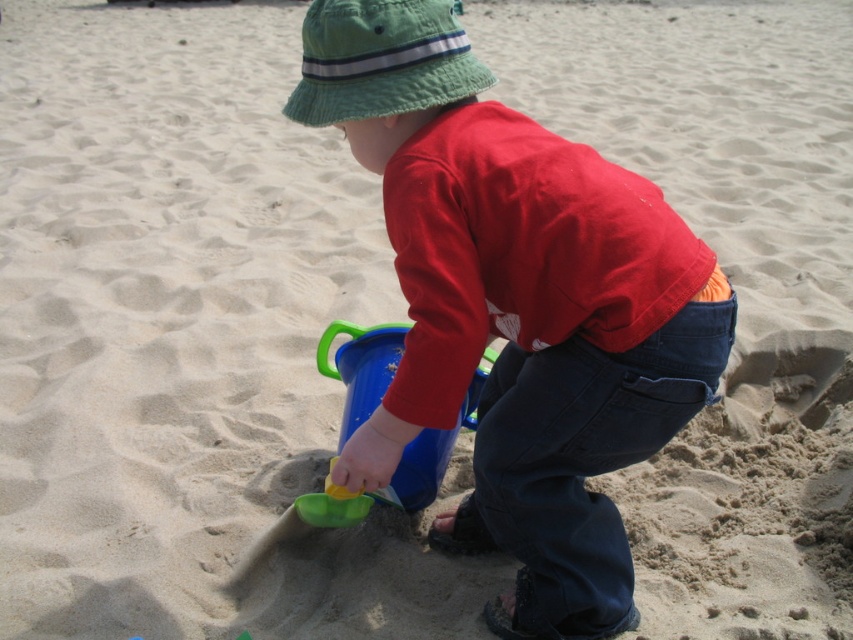
Question: Which point appears closest to the camera in this image?

Choices:
 (A) (380, 362)
 (B) (550, 513)

Answer: (B)

Question: Which point is closer to the camera?

Choices:
 (A) (431, 67)
 (B) (444, 49)
 (C) (350, 512)

Answer: (A)

Question: Is matte blue bucket at center positioned at the back of green fabric hat at upper center?

Choices:
 (A) yes
 (B) no

Answer: (B)

Question: Which point is closer to the camera?

Choices:
 (A) matte blue bucket at center
 (B) green plastic bucket at center
 (C) green fabric hat at upper center

Answer: (A)

Question: Does matte blue bucket at center appear under green plastic bucket at center?

Choices:
 (A) yes
 (B) no

Answer: (B)

Question: Can you confirm if matte blue bucket at center is bigger than green plastic bucket at center?

Choices:
 (A) yes
 (B) no

Answer: (A)